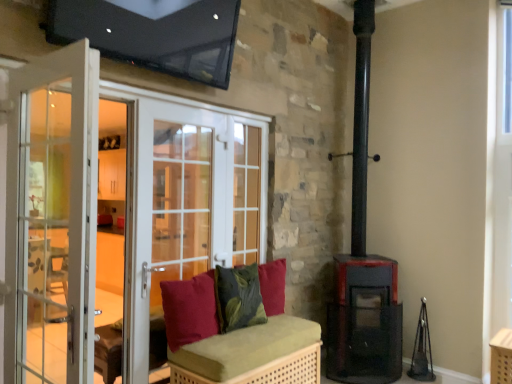
You are a GUI agent. You are given a task and a screenshot of the screen. Output one action in this format:
    pyautogui.click(x=<x>, y=<y>)
    Task: Click on the free point in front of green textured cushion at center, which is the second pillow from front to back
    This screenshot has width=512, height=384.
    Given the screenshot: What is the action you would take?
    pyautogui.click(x=239, y=340)